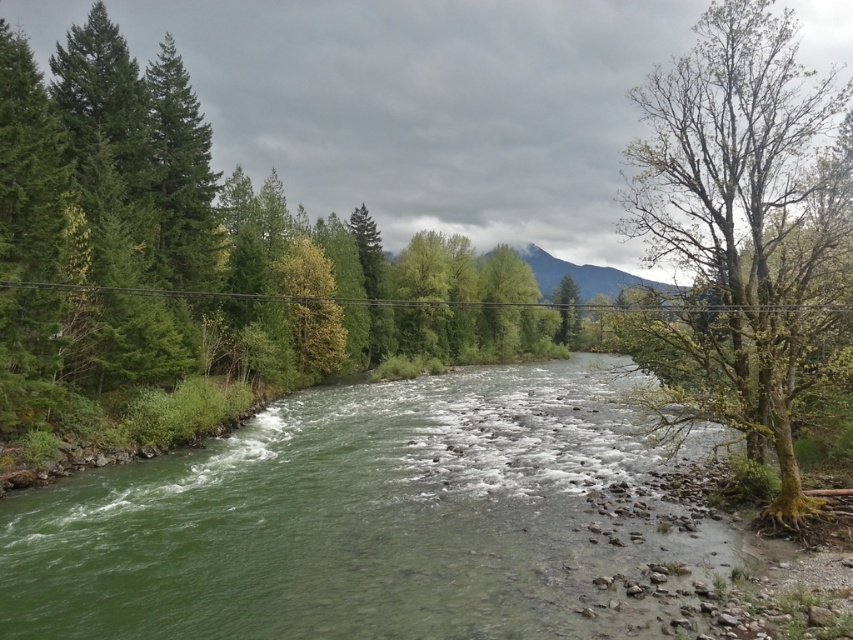
Question: Does green mossy tree at right have a smaller size compared to green leafy tree at center?

Choices:
 (A) no
 (B) yes

Answer: (A)

Question: Is green mossy tree at right to the right of green leafy tree at center from the viewer's perspective?

Choices:
 (A) no
 (B) yes

Answer: (B)

Question: Which object is positioned closest to the green smooth river at center?

Choices:
 (A) green leafy tree at center
 (B) green mossy tree at right

Answer: (B)

Question: Is green smooth river at center smaller than green leafy tree at center?

Choices:
 (A) no
 (B) yes

Answer: (B)

Question: Which is nearer to the green smooth river at center?

Choices:
 (A) green leafy tree at center
 (B) green mossy tree at right

Answer: (B)

Question: Which object is farther from the camera taking this photo?

Choices:
 (A) green leafy tree at center
 (B) green smooth river at center

Answer: (A)